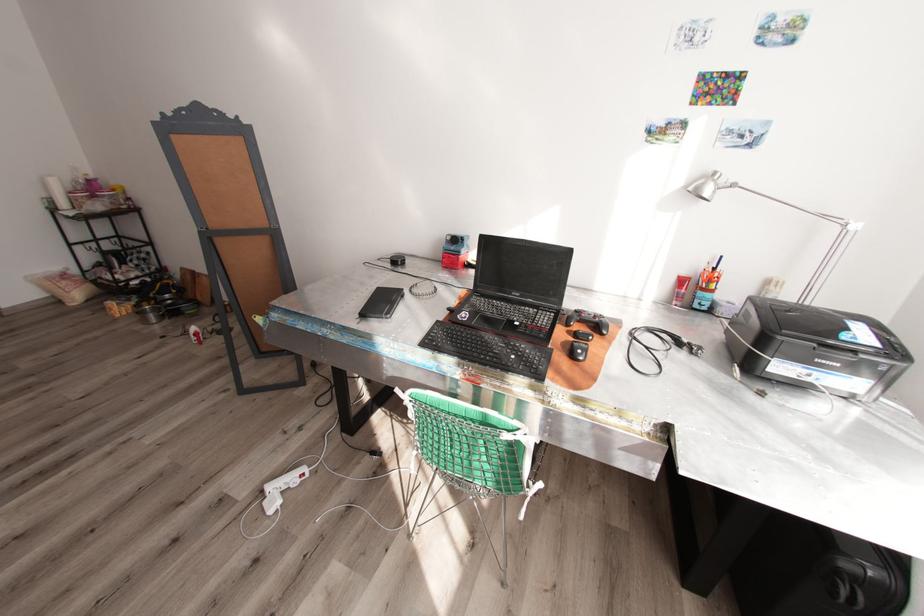
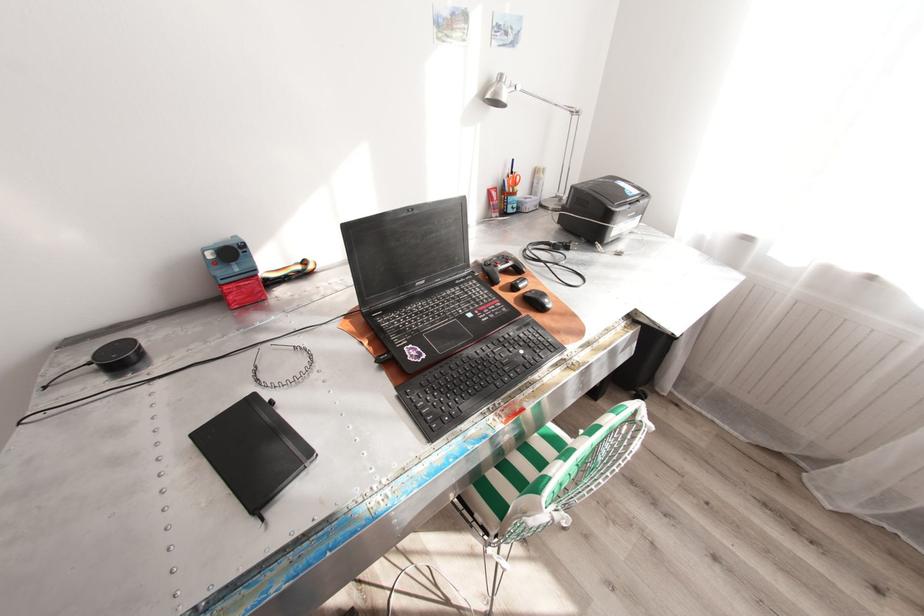
Find the pixel in the second image that matches [718,268] in the first image.

(517, 172)